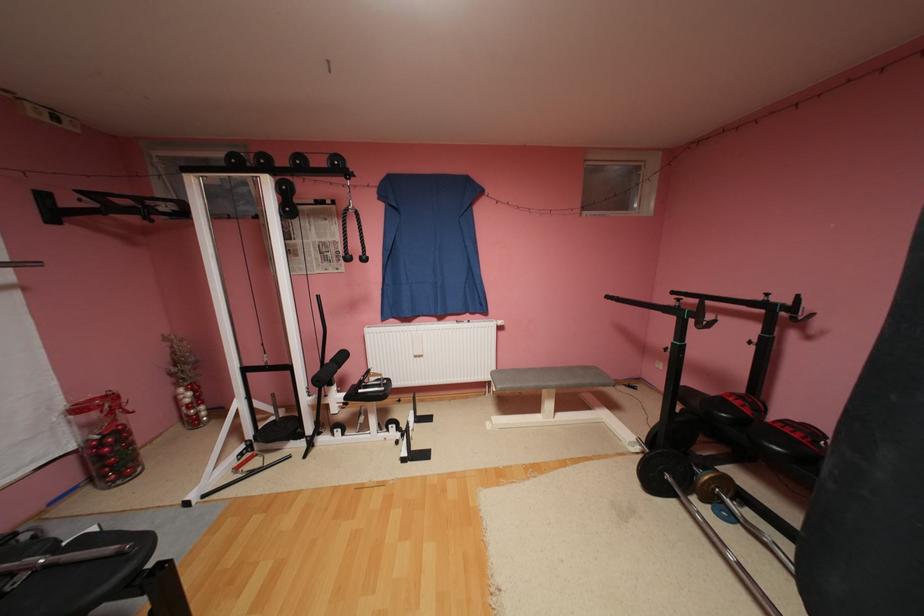
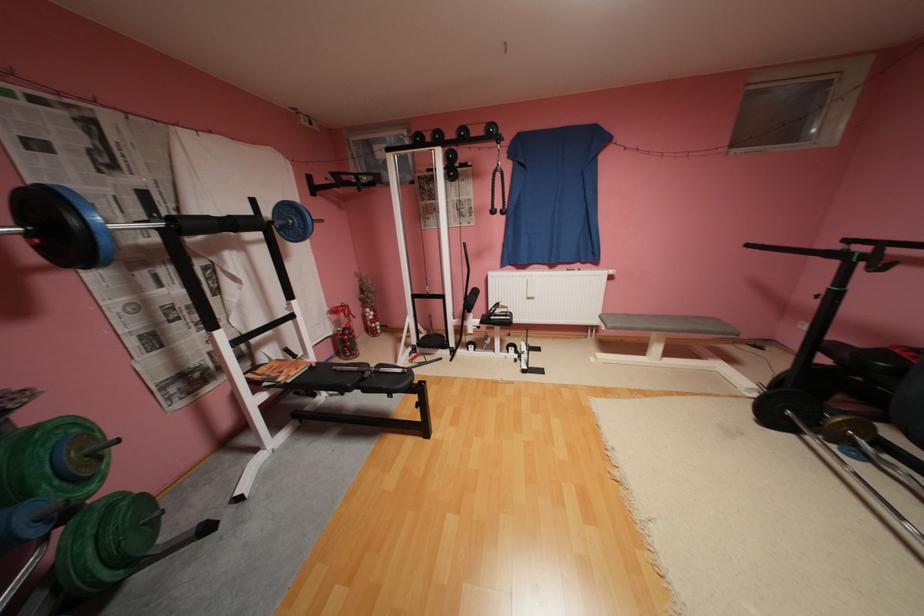
The point at [616,297] is marked in the first image. Where is the corresponding point in the second image?

(757, 246)